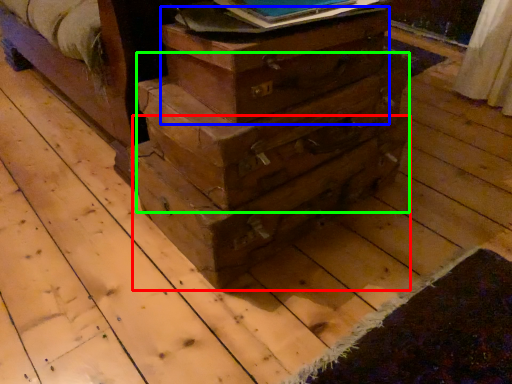
Question: Which is farther away from drawer (highlighted by a red box)? crate (highlighted by a blue box) or drawer (highlighted by a green box)?

Choices:
 (A) crate
 (B) drawer

Answer: (A)